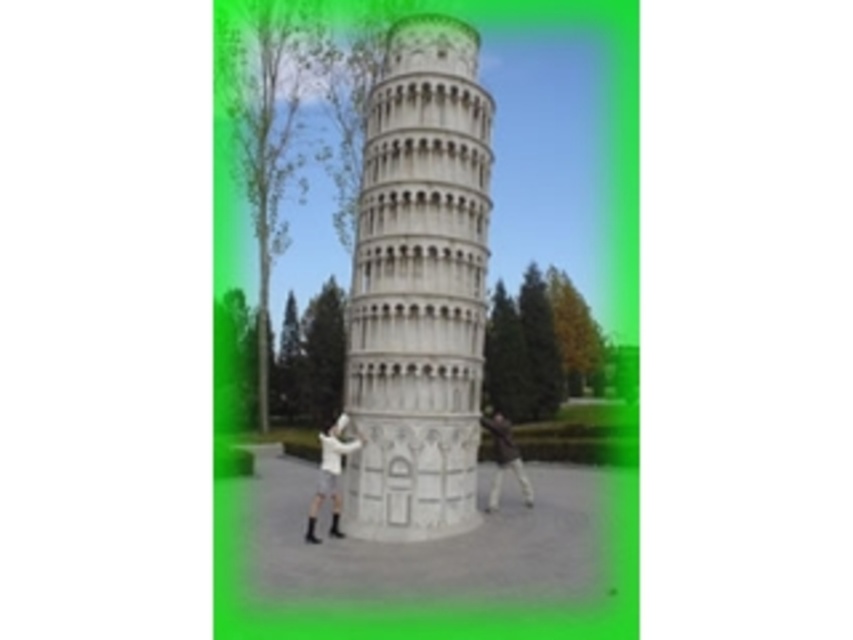
Can you confirm if white stone tower at center is smaller than white fabric shirt at center?

No, white stone tower at center is not smaller than white fabric shirt at center.

Between white stone tower at center and white fabric shirt at center, which one is positioned higher?

white stone tower at center is above.

Is point (424, 172) closer to camera compared to point (351, 445)?

No, it is not.

Image resolution: width=853 pixels, height=640 pixels. Identify the location of white stone tower at center. (419, 289).

Which is above, white stone tower at center or dark brown leather jacket at lower right?

white stone tower at center

Is point (444, 333) in front of point (486, 428)?

Yes, it is in front of point (486, 428).

This screenshot has height=640, width=853. I want to click on white stone tower at center, so click(419, 289).

Which of these two, white fabric shirt at center or dark brown leather jacket at lower right, stands taller?

Standing taller between the two is white fabric shirt at center.

Between point (334, 449) and point (497, 452), which one is positioned in front?

Point (334, 449) is in front.

Identify the location of white fabric shirt at center. (329, 476).